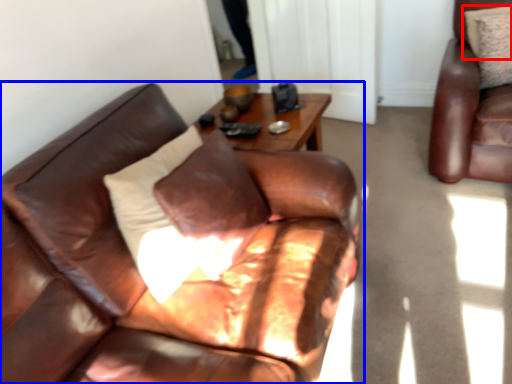
Question: Which of the following is the closest to the observer, pillow (highlighted by a red box) or studio couch (highlighted by a blue box)?

Choices:
 (A) pillow
 (B) studio couch

Answer: (B)